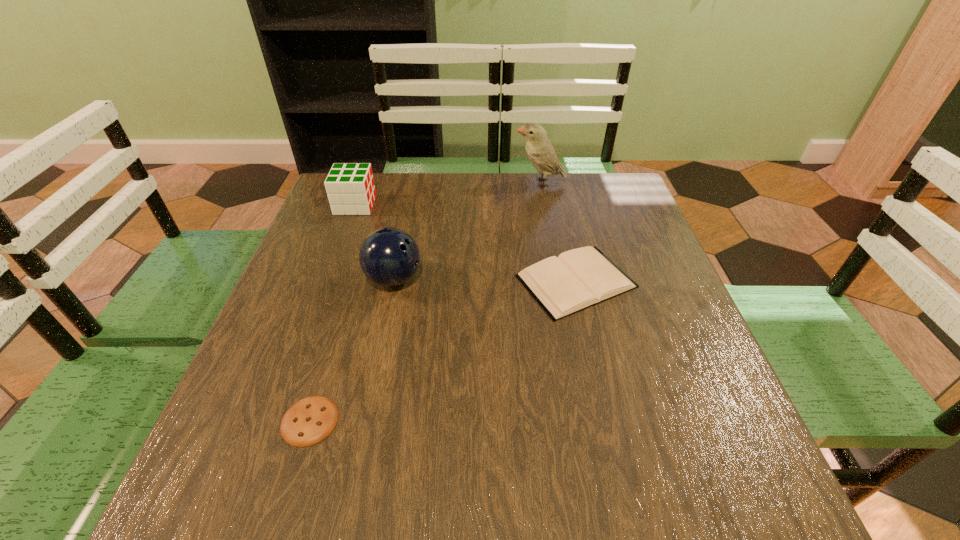
Image resolution: width=960 pixels, height=540 pixels. I want to click on free space located at the face of the tallest object, so click(x=398, y=183).

This screenshot has width=960, height=540. In order to click on free space located on the surface of the fourth shortest object near the finger holes in this screenshot , I will do `click(462, 279)`.

Identify the location of vacant space located on the red face of the third shortest object. The width and height of the screenshot is (960, 540). point(486,205).

I want to click on free region located on the front of the fourth tallest object, so click(605, 404).

At what (x,y) coordinates should I click in order to perform the action: click on blank area located 0.090m on the front of the cookie. Please return your answer as a coordinate pair (x, y). The height and width of the screenshot is (540, 960). Looking at the image, I should click on (283, 507).

I want to click on bird that is at the far edge, so click(539, 149).

The width and height of the screenshot is (960, 540). I want to click on cube at the far edge, so click(x=350, y=187).

What are the coordinates of `cube at the left edge` in the screenshot? It's located at (x=350, y=187).

In order to click on cookie that is at the left edge in this screenshot , I will do `click(310, 420)`.

Locate an element on the screen. This screenshot has height=540, width=960. object located at the right edge is located at coordinates (579, 278).